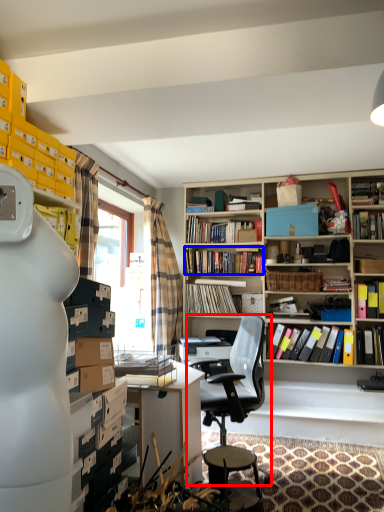
Question: Which point is closer to the camera, chair (highlighted by a red box) or book (highlighted by a blue box)?

Choices:
 (A) chair
 (B) book

Answer: (A)